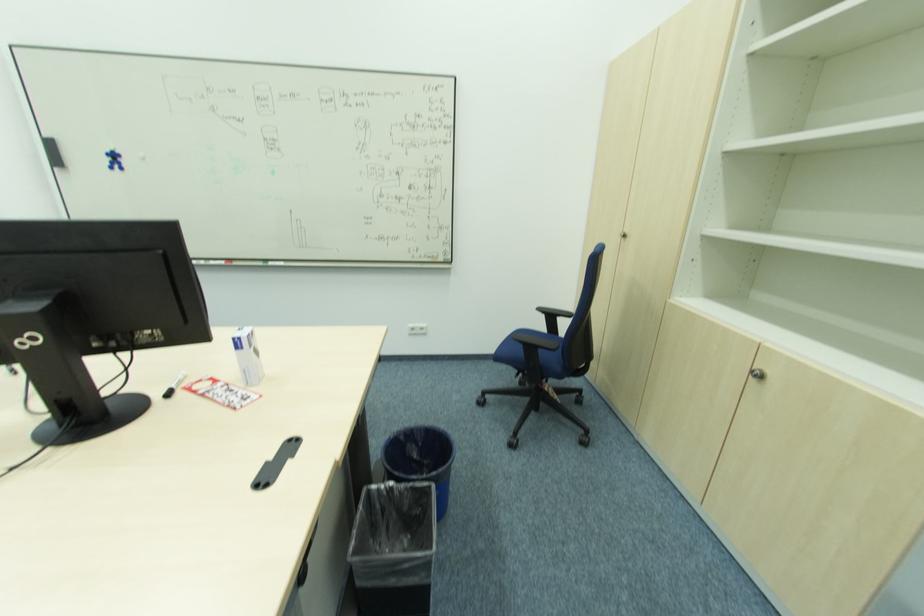
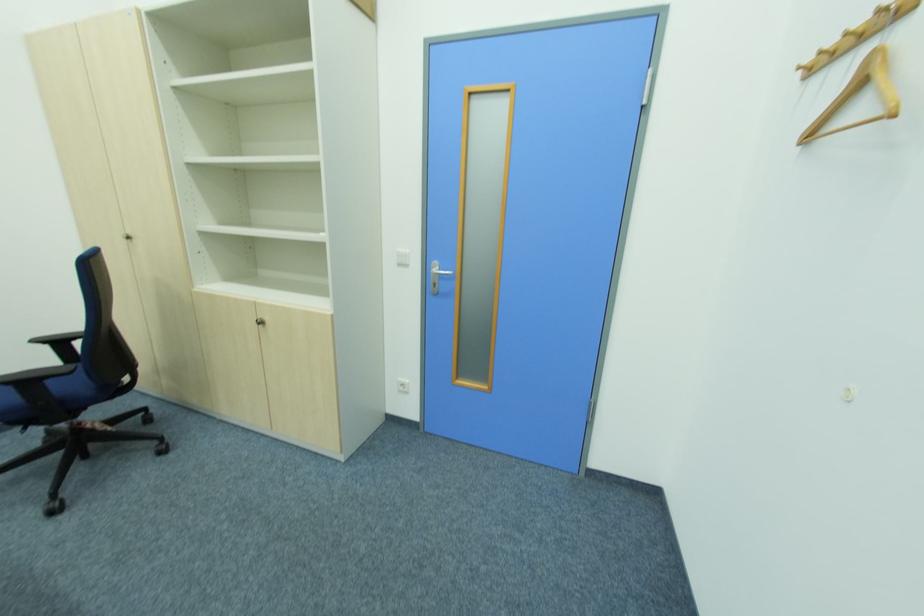
The point at (550, 391) is marked in the first image. Where is the corresponding point in the second image?

(91, 429)